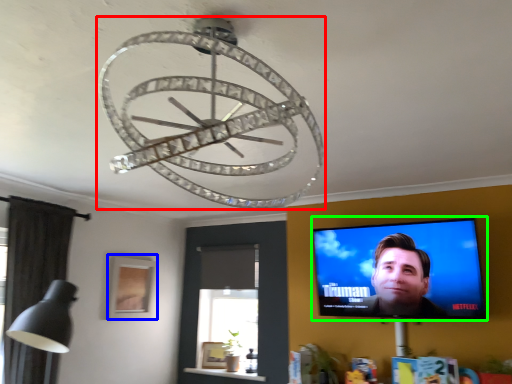
Question: Which object is positioned farthest from lamp (highlighted by a red box)? Select from picture frame (highlighted by a blue box) and computer screen (highlighted by a green box).

Choices:
 (A) picture frame
 (B) computer screen

Answer: (A)